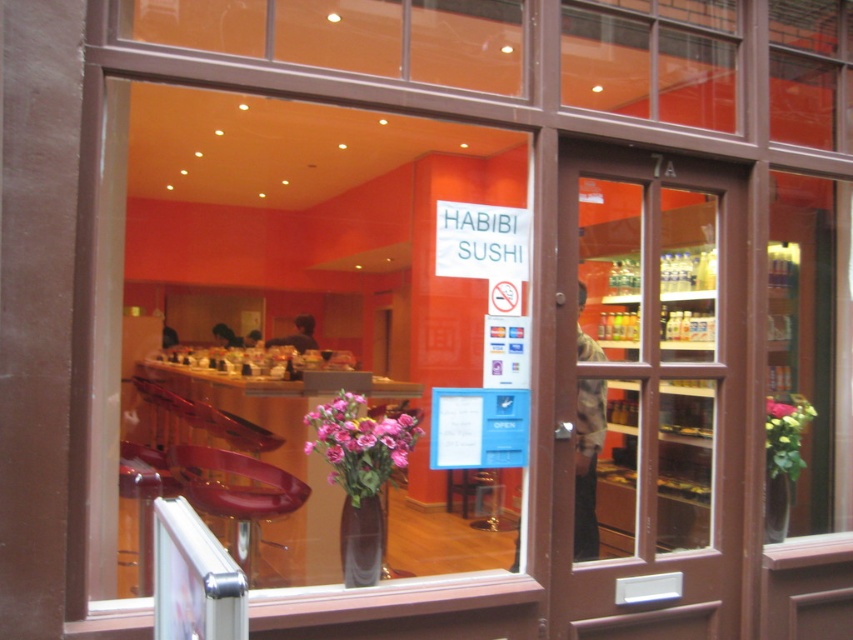
Question: Is brown wooden door at center closer to camera compared to translucent glass vase at center?

Choices:
 (A) yes
 (B) no

Answer: (B)

Question: Is pink matte vase at center smaller than translucent glass vase at lower right?

Choices:
 (A) no
 (B) yes

Answer: (A)

Question: Among these points, which one is farthest from the camera?

Choices:
 (A) (340, 408)
 (B) (769, 422)
 (C) (341, 564)

Answer: (B)

Question: Among these points, which one is nearest to the camera?

Choices:
 (A) (619, 403)
 (B) (325, 422)

Answer: (B)

Question: Is translucent glass vase at center above translucent glass vase at lower right?

Choices:
 (A) yes
 (B) no

Answer: (A)

Question: Which point appears closest to the camera in this image?

Choices:
 (A) (621, 480)
 (B) (763, 536)
 (C) (788, 467)
 (D) (366, 426)

Answer: (D)